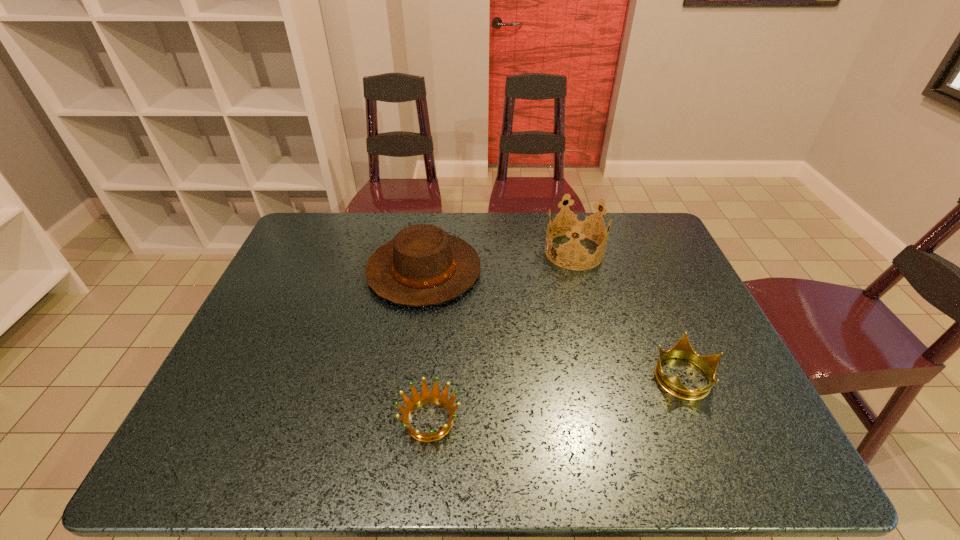
Where is `vacant area that lies between the tallest object and the cowboy hat`? The height and width of the screenshot is (540, 960). vacant area that lies between the tallest object and the cowboy hat is located at coordinates (499, 261).

Image resolution: width=960 pixels, height=540 pixels. I want to click on vacant area between the second shortest crown and the cowboy hat, so click(x=554, y=323).

Locate an element on the screen. free spot between the rightmost object and the shortest crown is located at coordinates (557, 399).

Identify the location of free space that is in between the shortest object and the farthest crown. (502, 336).

In order to click on free spot between the third tallest object and the shortest crown in this screenshot , I will do `click(557, 399)`.

I want to click on free spot between the tallest crown and the cowboy hat, so click(x=499, y=261).

Where is `free space between the farthest crown and the second tallest object`? The height and width of the screenshot is (540, 960). free space between the farthest crown and the second tallest object is located at coordinates (499, 261).

In order to click on free space between the rightmost object and the leftmost crown in this screenshot , I will do `click(557, 399)`.

Where is `free area in between the farthest crown and the second shortest crown`? The width and height of the screenshot is (960, 540). free area in between the farthest crown and the second shortest crown is located at coordinates (629, 314).

Where is `vacant point located between the shortest object and the rightmost crown`? vacant point located between the shortest object and the rightmost crown is located at coordinates (557, 399).